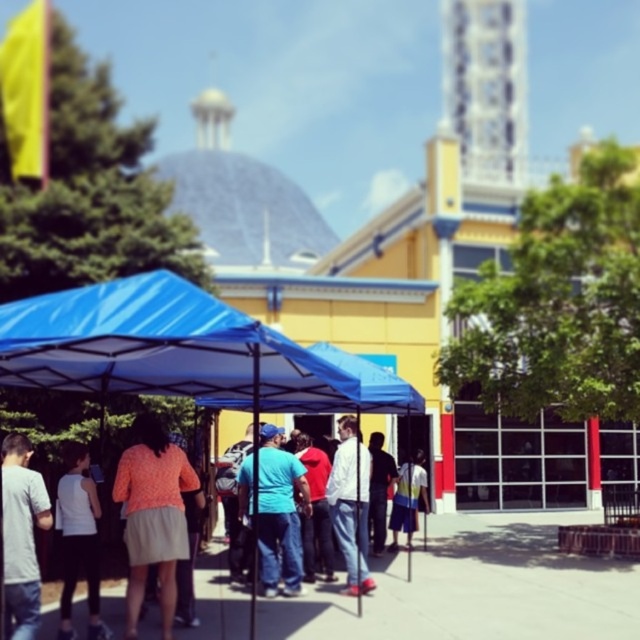
You are a photographer trying to capture a group photo of the people under the blue canopy tent. The blue cotton shirt at center and the white matte shirt at center are both in your frame. If you want to ensure both shirts are fully visible in the photo, which shirt should you focus on to avoid cropping either?

The blue cotton shirt at center might be wider than the white matte shirt at center, so focusing on the blue cotton shirt at center would ensure both shirts are fully visible without cropping.

You are a photographer trying to capture a candid shot of the white matte tank top at lower left and the blue denim jeans at center. Since you want to ensure both are visible in the frame, which clothing item requires a wider angle lens to accommodate its size?

The white matte tank top at lower left requires a wider angle lens because its width is larger than the blue denim jeans at center.